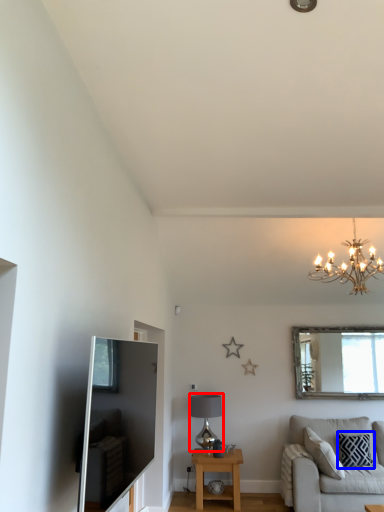
Question: Which of the following is the closest to the observer, lamp (highlighted by a red box) or pillow (highlighted by a blue box)?

Choices:
 (A) lamp
 (B) pillow

Answer: (B)